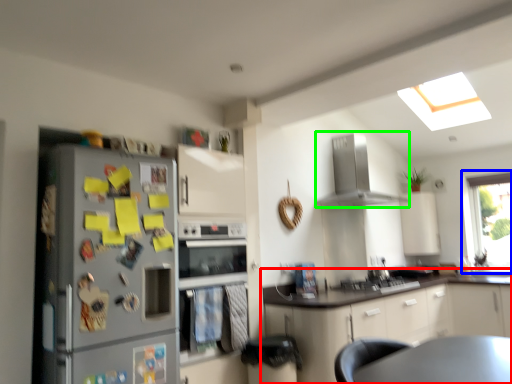
Question: Which object is the farthest from cabinetry (highlighted by a red box)? Choose among these: window (highlighted by a blue box) or home appliance (highlighted by a green box).

Choices:
 (A) window
 (B) home appliance

Answer: (A)